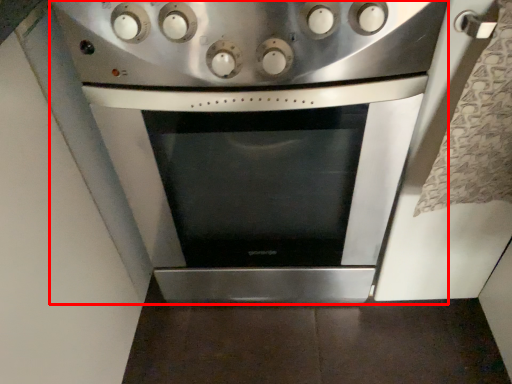
Question: Where is kitchen appliance (annotated by the red box) located in relation to gas stove in the image?

Choices:
 (A) right
 (B) left

Answer: (A)